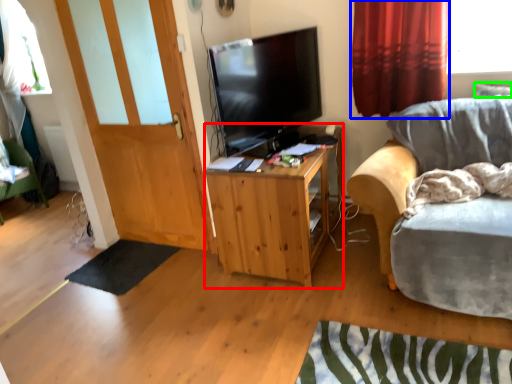
Question: Which object is the farthest from cabinetry (highlighted by a red box)? Choose among these: curtain (highlighted by a blue box) or pillow (highlighted by a green box).

Choices:
 (A) curtain
 (B) pillow

Answer: (B)